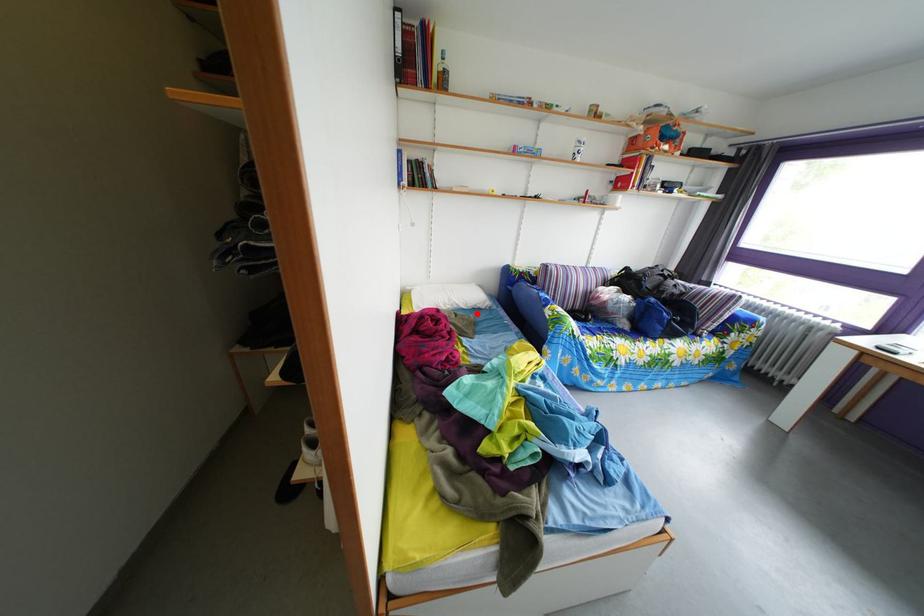
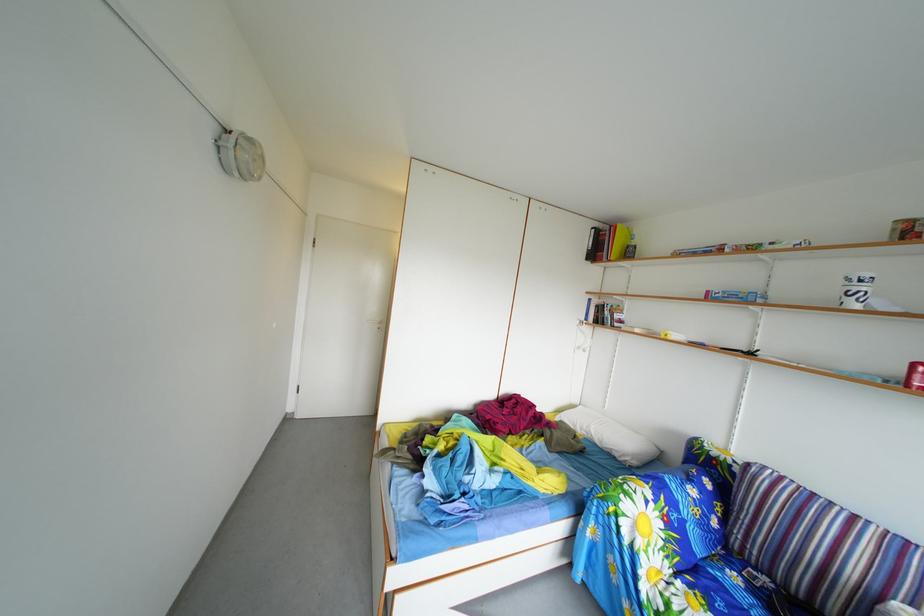
Question: A red point is marked in image1. In image2, is the corresponding 3D point closer to the camera or farther? Reply with the corresponding letter.

Choices:
 (A) The corresponding 3D point is closer.
 (B) The corresponding 3D point is farther.

Answer: (B)